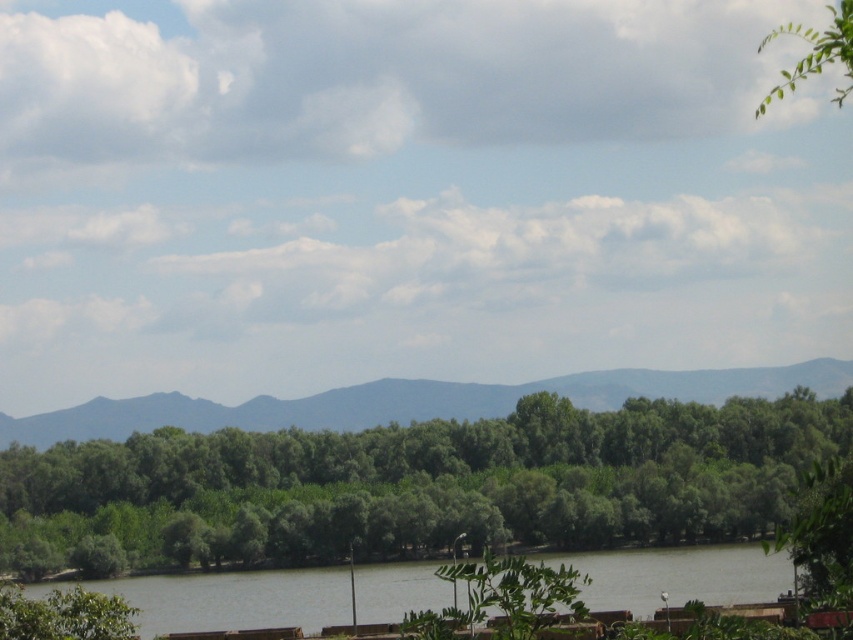
You are standing at the edge of the water in the scene. There is a gray distant mountain at center located at point [413,401]. If you want to walk towards that mountain, in which direction should you head from your current position?

The gray distant mountain at center is located at point [413,401], which is at the center of the image. Since you are at the edge of the water in the foreground, you should head towards the center of the image to walk towards the mountain.